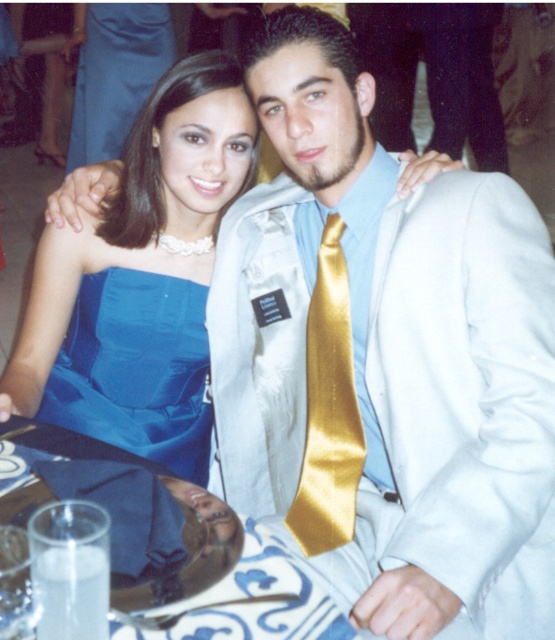
Question: Which of the following is the closest to the observer?

Choices:
 (A) blue satin dress at upper left
 (B) porcelain plate at center

Answer: (B)

Question: Which is farther from the satin white suit at center?

Choices:
 (A) satin blue dress at lower left
 (B) porcelain plate at center

Answer: (B)

Question: Does porcelain plate at center lie behind blue satin dress at upper left?

Choices:
 (A) yes
 (B) no

Answer: (B)

Question: Is satin blue dress at lower left in front of gold satin tie at center?

Choices:
 (A) yes
 (B) no

Answer: (B)

Question: Which point appears closest to the camera in this image?

Choices:
 (A) (93, 429)
 (B) (107, 298)

Answer: (B)

Question: Does satin blue dress at lower left come behind gold satin tie at center?

Choices:
 (A) no
 (B) yes

Answer: (B)